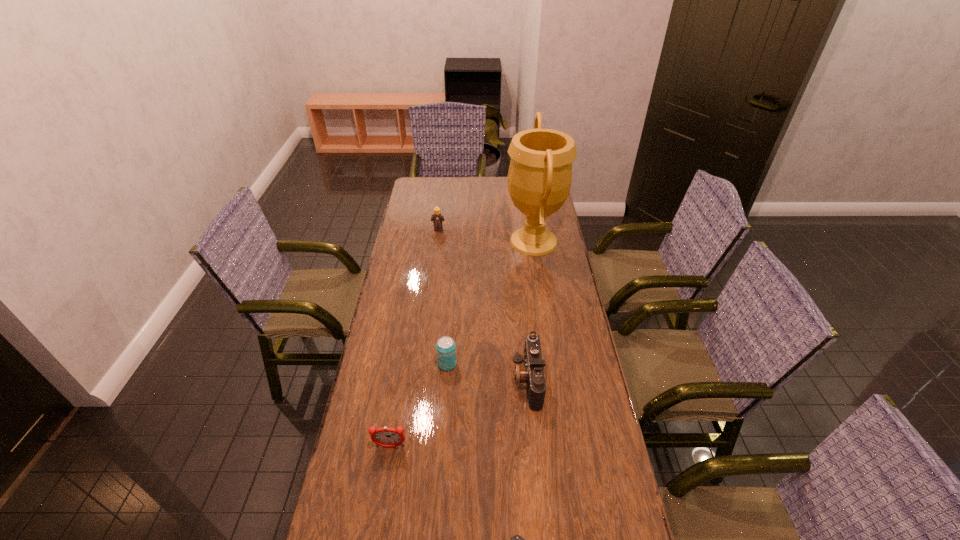
Select which object is the closest to the Lego. Please provide its 2D coordinates. Your answer should be formatted as a tuple, i.e. [(x, y)], where the tuple contains the x and y coordinates of a point satisfying the conditions above.

[(540, 173)]

The height and width of the screenshot is (540, 960). What are the coordinates of `vacant space that satisfies the following two spatial constraints: 1. on the engravings side of the trophy; 2. on the front-facing side of the fifth farthest object` in the screenshot? It's located at (565, 447).